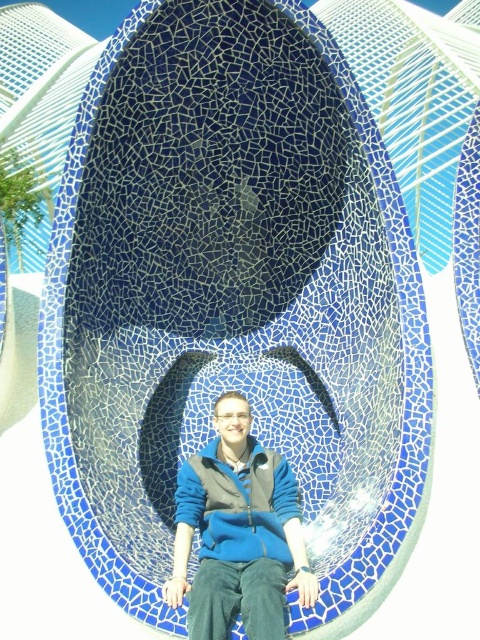
Which is behind, point (244, 529) or point (248, 497)?

Point (248, 497)

Measure the distance between blue matte sweater at center and camera.

A distance of 115.76 feet exists between blue matte sweater at center and camera.

Measure the distance between point (278, 560) and camera.

Point (278, 560) and camera are 40.43 meters apart from each other.

I want to click on blue matte sweater at center, so click(238, 532).